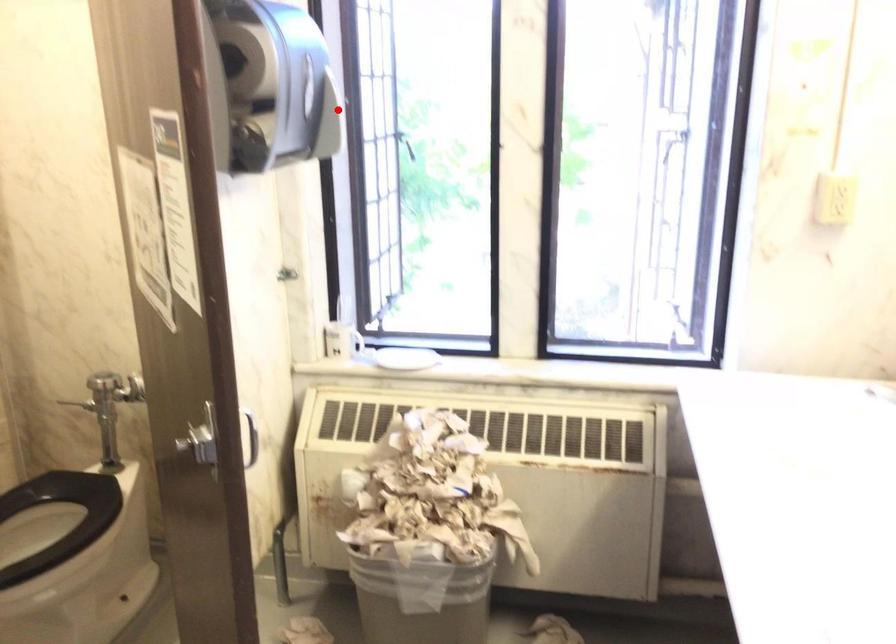
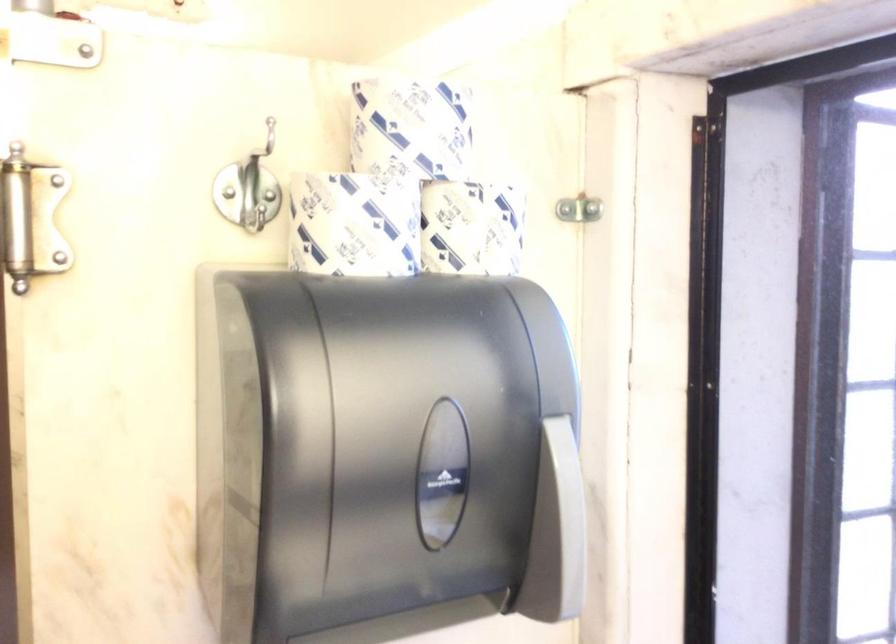
The point at the highlighted location is marked in the first image. Where is the corresponding point in the second image?

(557, 532)